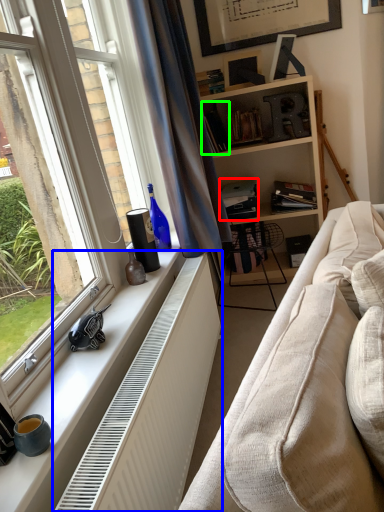
Question: Which object is the closest to the book (highlighted by a red box)? Choose among these: radiator (highlighted by a blue box) or book (highlighted by a green box).

Choices:
 (A) radiator
 (B) book

Answer: (B)